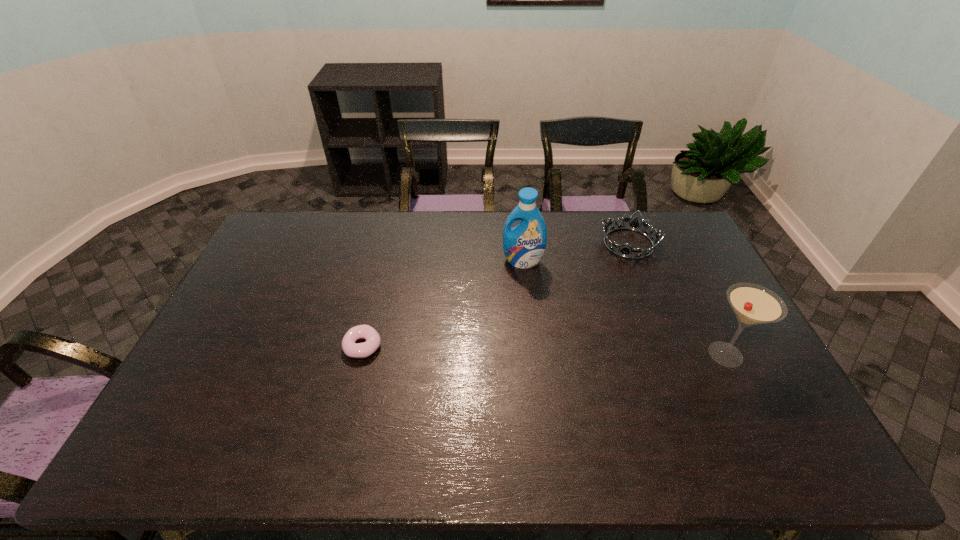
Find the location of `free spot between the tallest object and the shortest object`. free spot between the tallest object and the shortest object is located at coordinates (x=443, y=303).

Where is `vacant space that's between the martini and the leftmost object`? This screenshot has height=540, width=960. vacant space that's between the martini and the leftmost object is located at coordinates (544, 350).

The width and height of the screenshot is (960, 540). I want to click on free space between the martini and the second object from left to right, so click(x=624, y=308).

Identify the location of free space between the tallest object and the martini. The image size is (960, 540). point(624,308).

Image resolution: width=960 pixels, height=540 pixels. What are the coordinates of `object that ranks as the third closest to the leftmost object` in the screenshot? It's located at (753, 304).

Select which object is the second closest to the tiara. Please provide its 2D coordinates. Your answer should be formatted as a tuple, i.e. [(x, y)], where the tuple contains the x and y coordinates of a point satisfying the conditions above.

[(753, 304)]

You are a GUI agent. You are given a task and a screenshot of the screen. Output one action in this format:
    pyautogui.click(x=<x>, y=<y>)
    Task: Click on the vacant area that satisfies the following two spatial constraints: 1. on the front side of the martini; 2. on the right side of the second object from left to right
    The width and height of the screenshot is (960, 540).
    Given the screenshot: What is the action you would take?
    pyautogui.click(x=533, y=354)